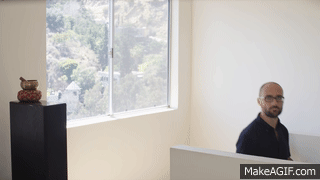
Identify the location of windowsill. (89, 120).